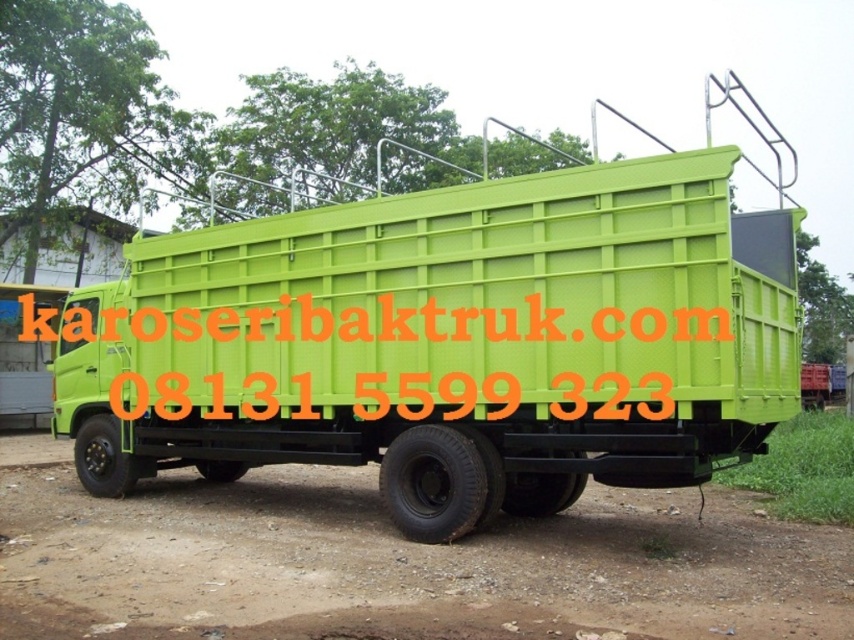
Question: Based on their relative distances, which object is nearer to the green plastic container at center?

Choices:
 (A) brown dirt track at lower center
 (B) green plastic text at center

Answer: (A)

Question: Based on their relative distances, which object is nearer to the green plastic text at center?

Choices:
 (A) brown dirt track at lower center
 (B) green plastic container at center

Answer: (A)

Question: Does green plastic container at center have a lesser width compared to green plastic text at center?

Choices:
 (A) no
 (B) yes

Answer: (A)

Question: Does green plastic container at center have a larger size compared to green plastic text at center?

Choices:
 (A) yes
 (B) no

Answer: (A)

Question: Can you confirm if brown dirt track at lower center is positioned above green plastic text at center?

Choices:
 (A) yes
 (B) no

Answer: (B)

Question: Which object appears farthest from the camera in this image?

Choices:
 (A) brown dirt track at lower center
 (B) green plastic container at center
 (C) green plastic text at center

Answer: (C)